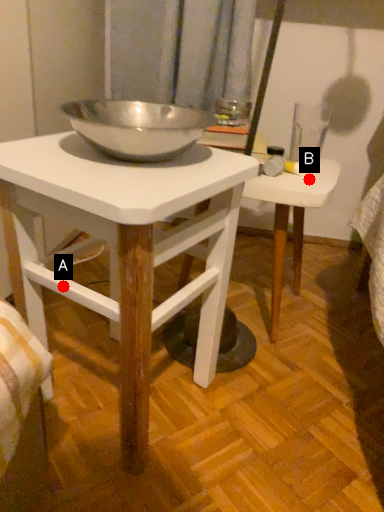
Question: Two points are circled on the image, labeled by A and B beside each circle. Among these points, which one is farthest from the camera?

Choices:
 (A) A is further
 (B) B is further

Answer: (B)